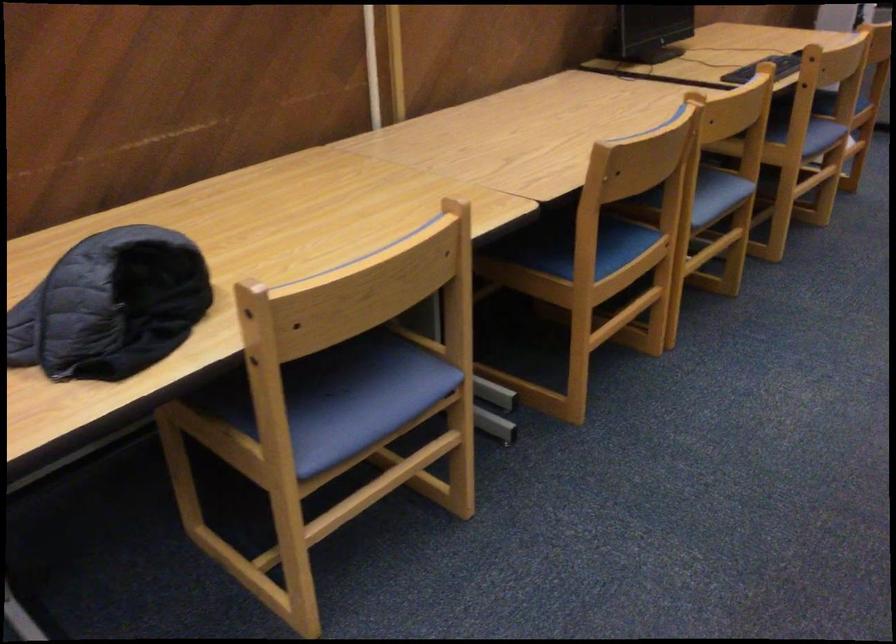
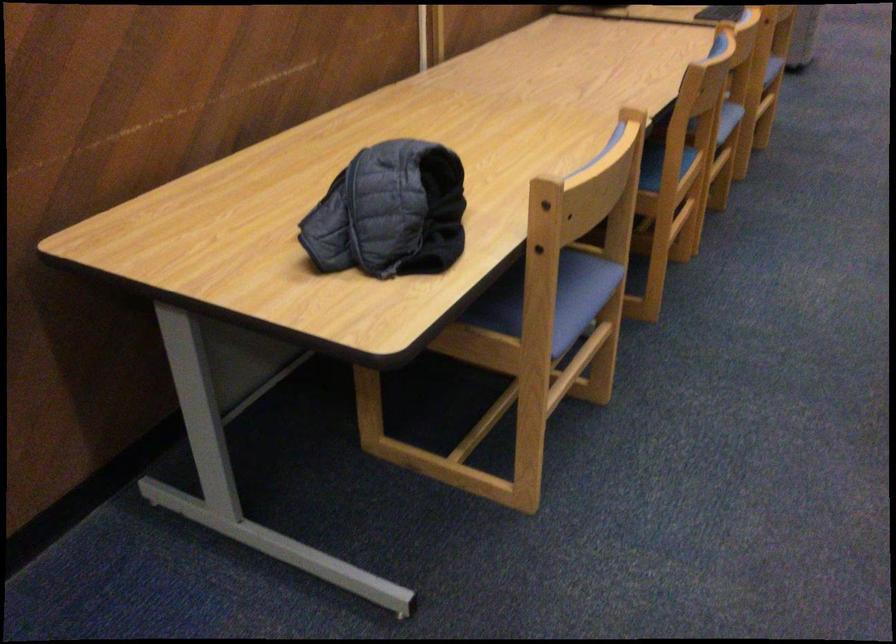
Find the pixel in the second image that matches (x=362, y=406) in the first image.

(561, 299)